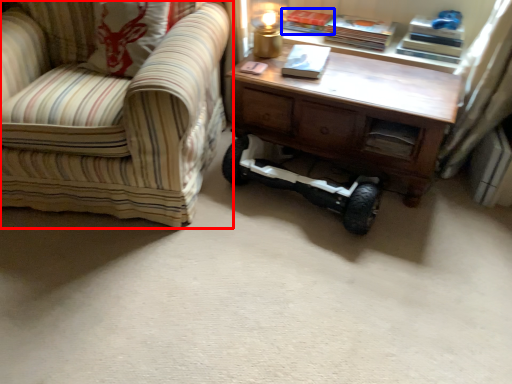
Question: Which object appears closest to the camera in this image, chair (highlighted by a red box) or book (highlighted by a blue box)?

Choices:
 (A) chair
 (B) book

Answer: (A)